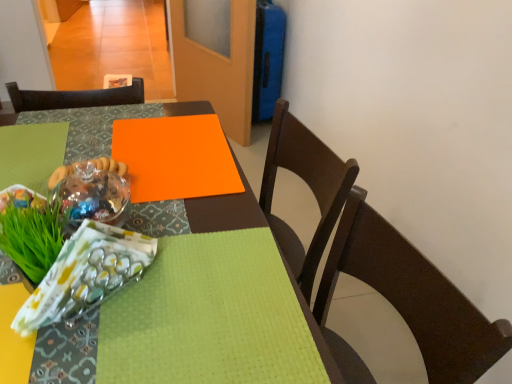
Question: From a real-world perspective, is orange matte board at center physically located above or below translucent glass bowl at center?

Choices:
 (A) above
 (B) below

Answer: (B)

Question: From the image's perspective, is orange matte board at center located above or below translucent glass bowl at center?

Choices:
 (A) below
 (B) above

Answer: (B)

Question: Which of these objects is positioned farthest from the green leafy grass at lower left?

Choices:
 (A) translucent glass bowl at center
 (B) matte brown chair at center
 (C) translucent plastic bag at lower left
 (D) matte orange placemat at center
 (E) orange matte board at center

Answer: (B)

Question: Which object is positioned closest to the matte brown chair at center?

Choices:
 (A) orange matte board at center
 (B) green leafy grass at lower left
 (C) matte orange placemat at center
 (D) translucent plastic bag at lower left
 (E) translucent glass bowl at center

Answer: (C)